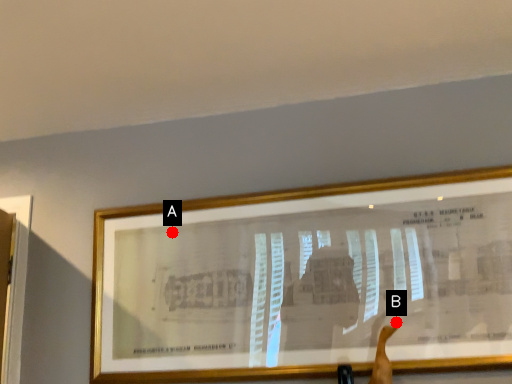
Question: Two points are circled on the image, labeled by A and B beside each circle. Which point is closer to the camera taking this photo?

Choices:
 (A) A is closer
 (B) B is closer

Answer: (B)